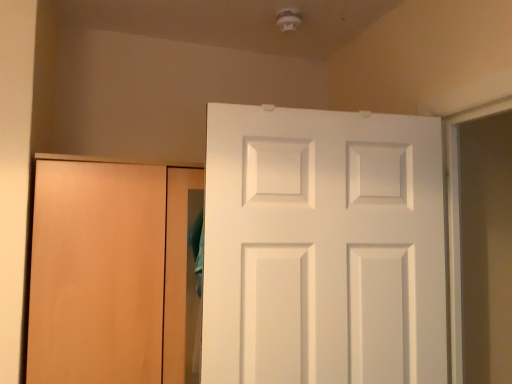
Question: Can you confirm if matte wood door at left, arranged as the 1th door when viewed from the left, is shorter than white matte door at center, the second door when ordered from left to right?

Choices:
 (A) yes
 (B) no

Answer: (B)

Question: From the image's perspective, would you say matte wood door at left, arranged as the 1th door when viewed from the left, is positioned over white matte door at center, the second door when ordered from left to right?

Choices:
 (A) no
 (B) yes

Answer: (A)

Question: From the image's perspective, is matte wood door at left, which ranks as the second door in right-to-left order, located beneath white matte door at center, positioned as the first door in right-to-left order?

Choices:
 (A) yes
 (B) no

Answer: (A)

Question: Does matte wood door at left, arranged as the 1th door when viewed from the left, have a greater height compared to white matte door at center, positioned as the first door in right-to-left order?

Choices:
 (A) yes
 (B) no

Answer: (A)

Question: Is matte wood door at left, arranged as the 1th door when viewed from the left, in contact with white matte door at center, the second door when ordered from left to right?

Choices:
 (A) no
 (B) yes

Answer: (A)

Question: Can you confirm if matte wood door at left, which ranks as the second door in right-to-left order, is wider than white matte door at center, the second door when ordered from left to right?

Choices:
 (A) yes
 (B) no

Answer: (A)

Question: Is white matte door at center, the second door when ordered from left to right, located outside matte wood door at left, arranged as the 1th door when viewed from the left?

Choices:
 (A) no
 (B) yes

Answer: (B)

Question: From the image's perspective, would you say white matte door at center, positioned as the first door in right-to-left order, is positioned over matte wood door at left, arranged as the 1th door when viewed from the left?

Choices:
 (A) no
 (B) yes

Answer: (B)

Question: Is white matte door at center, positioned as the first door in right-to-left order, positioned before matte wood door at left, arranged as the 1th door when viewed from the left?

Choices:
 (A) yes
 (B) no

Answer: (A)

Question: Is white matte door at center, the second door when ordered from left to right, bigger than matte wood door at left, which ranks as the second door in right-to-left order?

Choices:
 (A) no
 (B) yes

Answer: (A)

Question: Can you confirm if white matte door at center, positioned as the first door in right-to-left order, is taller than matte wood door at left, which ranks as the second door in right-to-left order?

Choices:
 (A) yes
 (B) no

Answer: (B)

Question: Is white matte door at center, the second door when ordered from left to right, aimed at matte wood door at left, arranged as the 1th door when viewed from the left?

Choices:
 (A) yes
 (B) no

Answer: (B)

Question: From a real-world perspective, is white matte door at center, the second door when ordered from left to right, positioned above or below matte wood door at left, arranged as the 1th door when viewed from the left?

Choices:
 (A) above
 (B) below

Answer: (A)